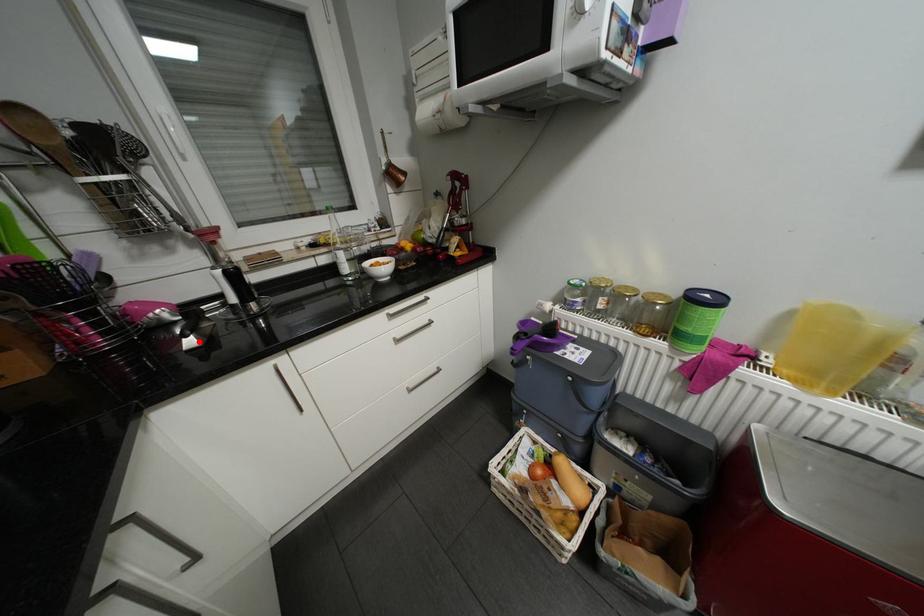
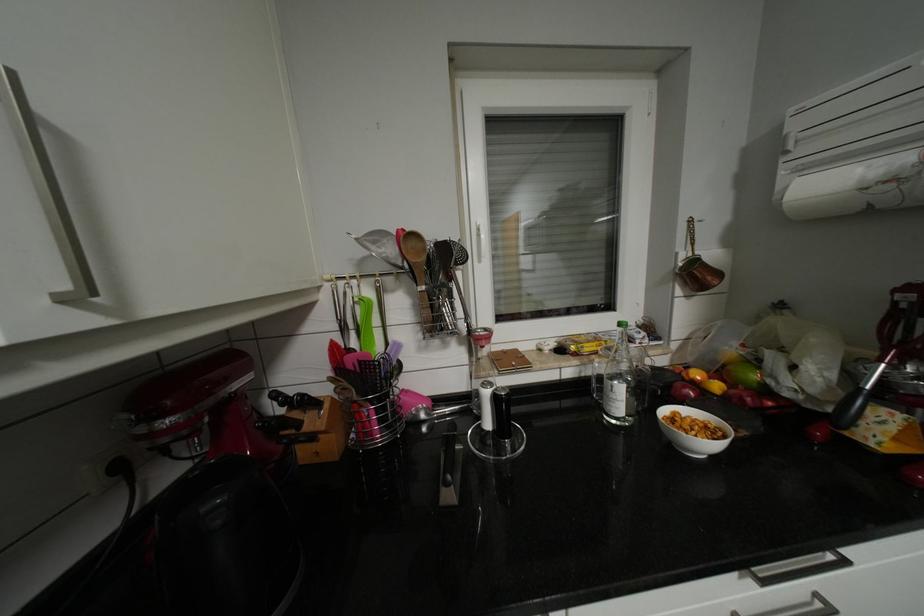
Where in the second image is the point corresponding to the highlighted location from the first image?

(456, 495)